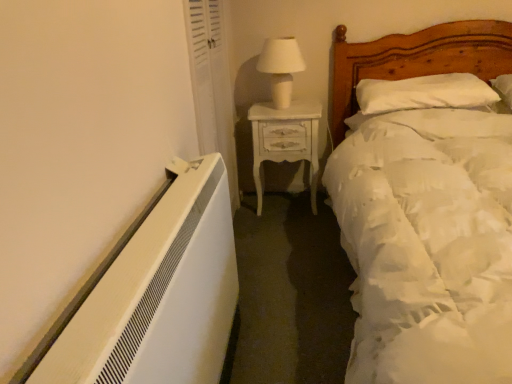
Where is `white soft bed at right`? Image resolution: width=512 pixels, height=384 pixels. white soft bed at right is located at coordinates (417, 58).

This screenshot has height=384, width=512. What are the coordinates of `white soft pillow at upper right` in the screenshot? It's located at (424, 93).

Based on the photo, does white glossy nightstand at center have a lesser height compared to white fabric curtain at upper left?

Correct, white glossy nightstand at center is not as tall as white fabric curtain at upper left.

Considering the positions of objects white glossy nightstand at center and white fabric curtain at upper left in the image provided, who is more to the right, white glossy nightstand at center or white fabric curtain at upper left?

From the viewer's perspective, white glossy nightstand at center appears more on the right side.

Looking at this image, from the image's perspective, which one is positioned lower, white glossy nightstand at center or white fabric curtain at upper left?

From the image's view, white glossy nightstand at center is below.

Does point (260, 131) appear closer or farther from the camera than point (216, 93)?

Point (260, 131) is farther from the camera than point (216, 93).

Would you say white soft pillow at upper right is a long distance from white soft bed at right?

Actually, white soft pillow at upper right and white soft bed at right are a little close together.

Considering the sizes of objects white soft pillow at upper right and white soft bed at right in the image provided, who is shorter, white soft pillow at upper right or white soft bed at right?

With less height is white soft pillow at upper right.

From the picture: From the image's perspective, is white soft pillow at upper right above white soft bed at right?

Yes, from the image's perspective, white soft pillow at upper right is above white soft bed at right.

Locate an element on the screen. The image size is (512, 384). bed that is below the white soft pillow at upper right (from the image's perspective) is located at coordinates (417, 58).

Are white soft bed at right and white ceramic table lamp at upper center far apart?

Actually, white soft bed at right and white ceramic table lamp at upper center are a little close together.

Which is in front, white soft bed at right or white ceramic table lamp at upper center?

white soft bed at right is in front.

Between white soft bed at right and white ceramic table lamp at upper center, which one has smaller size?

white ceramic table lamp at upper center is smaller.

Is white ceramic table lamp at upper center taller or shorter than white soft bed at right?

Clearly, white ceramic table lamp at upper center is shorter compared to white soft bed at right.

Which object is wider, white ceramic table lamp at upper center or white soft bed at right?

With larger width is white soft bed at right.

Does point (276, 58) come closer to viewer compared to point (462, 63)?

Yes, point (276, 58) is closer to viewer.

Looking at this image, from the image's perspective, is white soft bed at right above or below white fabric curtain at upper left?

Based on their image positions, white soft bed at right is located beneath white fabric curtain at upper left.

Is white fabric curtain at upper left completely or partially inside white soft bed at right?

Actually, white fabric curtain at upper left is outside white soft bed at right.

Is white ceramic table lamp at upper center far away from white glossy nightstand at center?

No, there isn't a large distance between white ceramic table lamp at upper center and white glossy nightstand at center.

Can you confirm if white ceramic table lamp at upper center is taller than white glossy nightstand at center?

Answer: In fact, white ceramic table lamp at upper center may be shorter than white glossy nightstand at center.

What's the angular difference between white ceramic table lamp at upper center and white glossy nightstand at center's facing directions?

They differ by 5.86 degrees in their facing directions.

Is white ceramic table lamp at upper center turned away from white glossy nightstand at center?

white ceramic table lamp at upper center does not have its back to white glossy nightstand at center.

From the image's perspective, would you say white soft bed at right is shown under white soft pillow at upper right?

Correct, white soft bed at right appears lower than white soft pillow at upper right in the image.

Is white soft bed at right not close to white soft pillow at upper right?

white soft bed at right is actually quite close to white soft pillow at upper right.

Can we say white soft bed at right lies outside white soft pillow at upper right?

Indeed, white soft bed at right is completely outside white soft pillow at upper right.

From a real-world perspective, is white soft bed at right positioned above or below white soft pillow at upper right?

white soft bed at right is below white soft pillow at upper right.

You are a GUI agent. You are given a task and a screenshot of the screen. Output one action in this format:
    pyautogui.click(x=<x>, y=<y>)
    Task: Click on the curtain on the left of white glossy nightstand at center
    
    Given the screenshot: What is the action you would take?
    pyautogui.click(x=212, y=85)

This screenshot has width=512, height=384. I want to click on pillow above the white soft bed at right (from the image's perspective), so click(x=424, y=93).

When comparing their distances from white ceramic table lamp at upper center, does white soft pillow at upper right or white soft bed at right seem further?

white soft pillow at upper right is positioned further to the anchor white ceramic table lamp at upper center.

When comparing their distances from white soft bed at right, does white glossy nightstand at center or white ceramic table lamp at upper center seem closer?

white glossy nightstand at center is positioned closer to the anchor white soft bed at right.

Estimate the real-world distances between objects in this image. Which object is further from white soft bed at right, white glossy nightstand at center or white soft pillow at upper right?

white glossy nightstand at center.

Considering their positions, is white glossy nightstand at center positioned closer to white fabric curtain at upper left than white ceramic table lamp at upper center?

The object closer to white fabric curtain at upper left is white glossy nightstand at center.

Based on the photo, which object lies further to the anchor point white soft pillow at upper right, white glossy nightstand at center or white ceramic table lamp at upper center?

white ceramic table lamp at upper center is positioned further to the anchor white soft pillow at upper right.

When comparing their distances from white ceramic table lamp at upper center, does white fabric curtain at upper left or white glossy nightstand at center seem closer?

white glossy nightstand at center lies closer to white ceramic table lamp at upper center than the other object.

When comparing their distances from white soft pillow at upper right, does white ceramic table lamp at upper center or white fabric curtain at upper left seem further?

Among the two, white fabric curtain at upper left is located further to white soft pillow at upper right.

From the image, which object appears to be nearer to white fabric curtain at upper left, white ceramic table lamp at upper center or white glossy nightstand at center?

Among the two, white glossy nightstand at center is located nearer to white fabric curtain at upper left.

Where is `curtain between white ceramic table lamp at upper center and white glossy nightstand at center in the up-down direction`? curtain between white ceramic table lamp at upper center and white glossy nightstand at center in the up-down direction is located at coordinates (212, 85).

Where is `curtain positioned between white soft bed at right and white soft pillow at upper right from near to far`? This screenshot has height=384, width=512. curtain positioned between white soft bed at right and white soft pillow at upper right from near to far is located at coordinates (212, 85).

Where is `pillow between white soft bed at right and white glossy nightstand at center in the front-back direction`? pillow between white soft bed at right and white glossy nightstand at center in the front-back direction is located at coordinates point(424,93).

The image size is (512, 384). Identify the location of curtain positioned between white soft bed at right and white glossy nightstand at center from near to far. (212, 85).